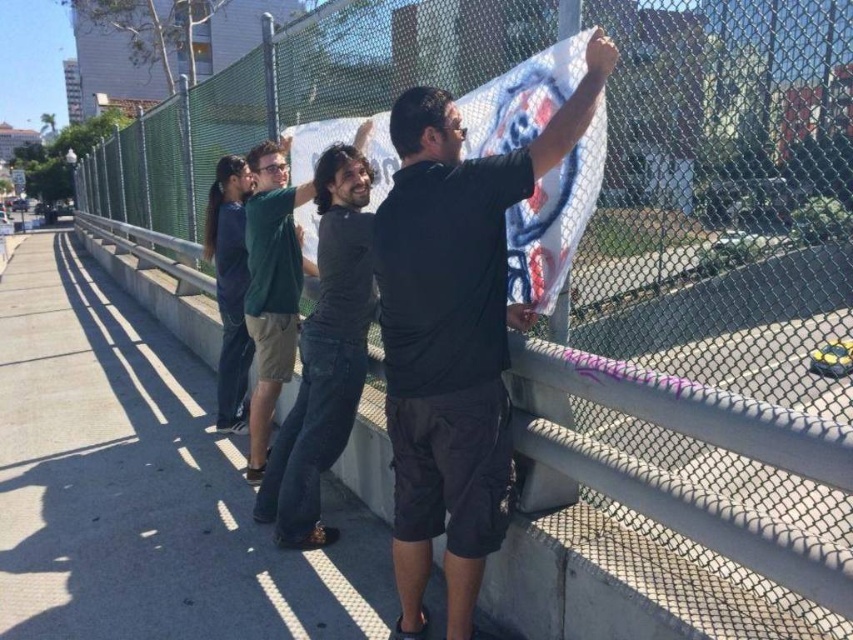
You are a photographer trying to capture a photo of the black matte shirt at center and the dark gray cotton shirt at center. Which shirt should you focus on first if you want to include both in the frame without moving the camera?

The black matte shirt at center is positioned on the right side of dark gray cotton shirt at center, so you should focus on the dark gray cotton shirt at center first since it is closer to the camera and then adjust the framing to include the black matte shirt at center on the right.

You are a photographer trying to capture a photo of the black matte shirt at center and the dark gray cotton shirt at center. Since you want both shirts to be clearly visible in the photo, which shirt should you focus on to ensure the one with the greater height is properly in focus?

You should focus on the black matte shirt at center because it has a greater height compared to the dark gray cotton shirt at center, ensuring proper focus on the taller shirt.